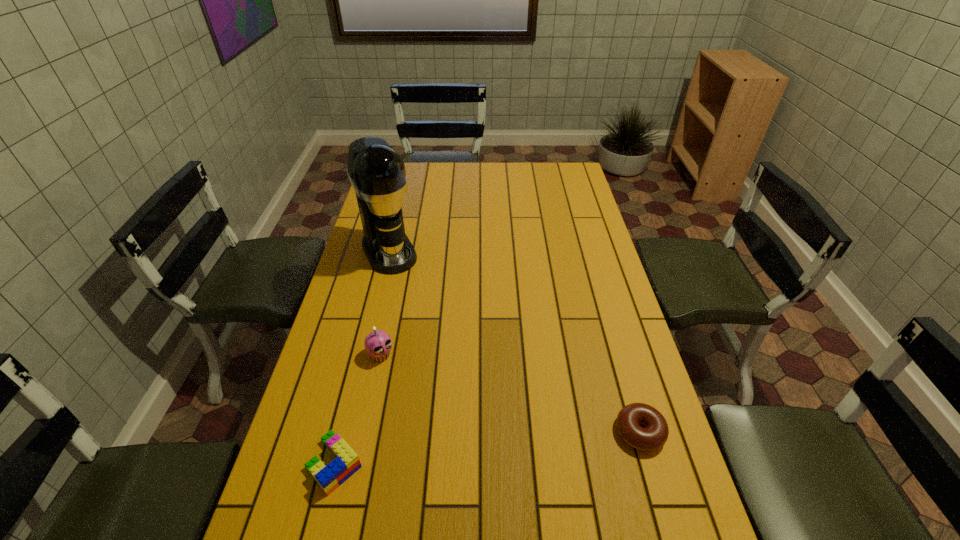
Locate an element on the screen. empty space between the third shortest object and the farthest object is located at coordinates (385, 303).

Locate an element on the screen. Image resolution: width=960 pixels, height=540 pixels. object that stands as the second closest to the third nearest object is located at coordinates (377, 173).

Locate which object ranks second in proximity to the rightmost object. Please provide its 2D coordinates. Your answer should be formatted as a tuple, i.e. [(x, y)], where the tuple contains the x and y coordinates of a point satisfying the conditions above.

[(346, 463)]

Where is `vacant space that satisfies the following two spatial constraints: 1. on the front side of the rightmost object; 2. on the left side of the second tallest object`? The image size is (960, 540). vacant space that satisfies the following two spatial constraints: 1. on the front side of the rightmost object; 2. on the left side of the second tallest object is located at coordinates (365, 432).